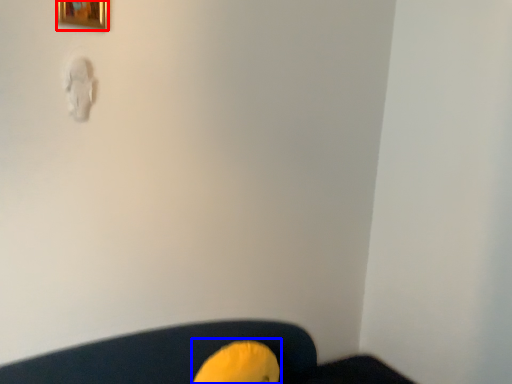
Question: Among these objects, which one is farthest to the camera, picture frame (highlighted by a red box) or bean bag chair (highlighted by a blue box)?

Choices:
 (A) picture frame
 (B) bean bag chair

Answer: (B)